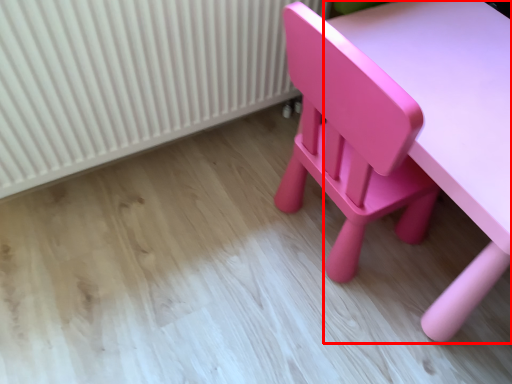
Question: In this image, where is table (annotated by the red box) located relative to radiator?

Choices:
 (A) right
 (B) left

Answer: (A)